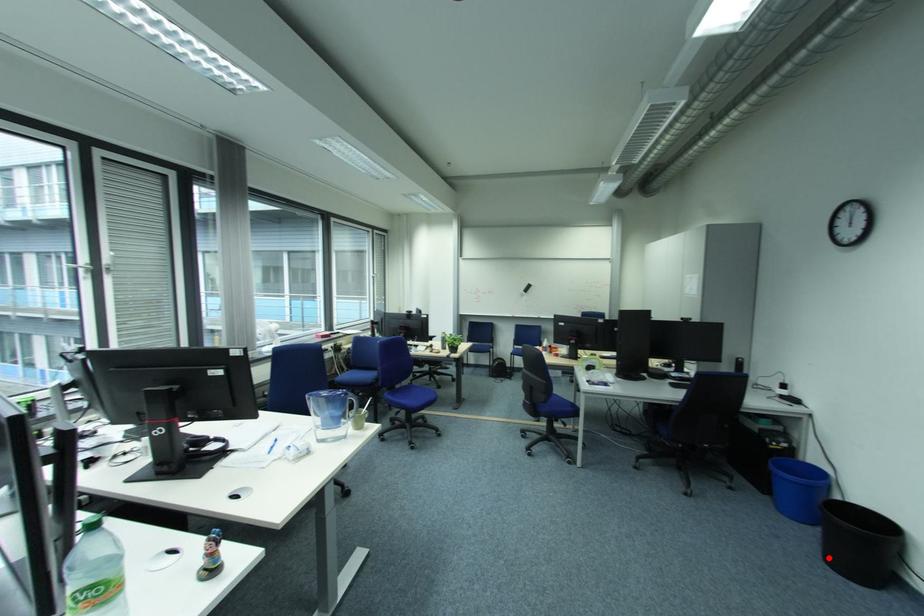
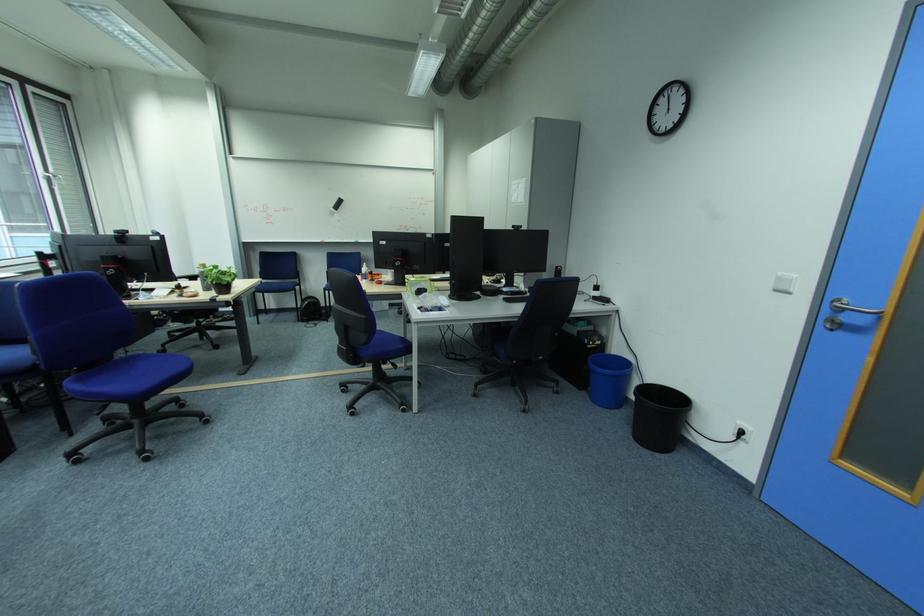
Where in the second image is the point corresponding to the highlighted location from the first image?

(640, 439)